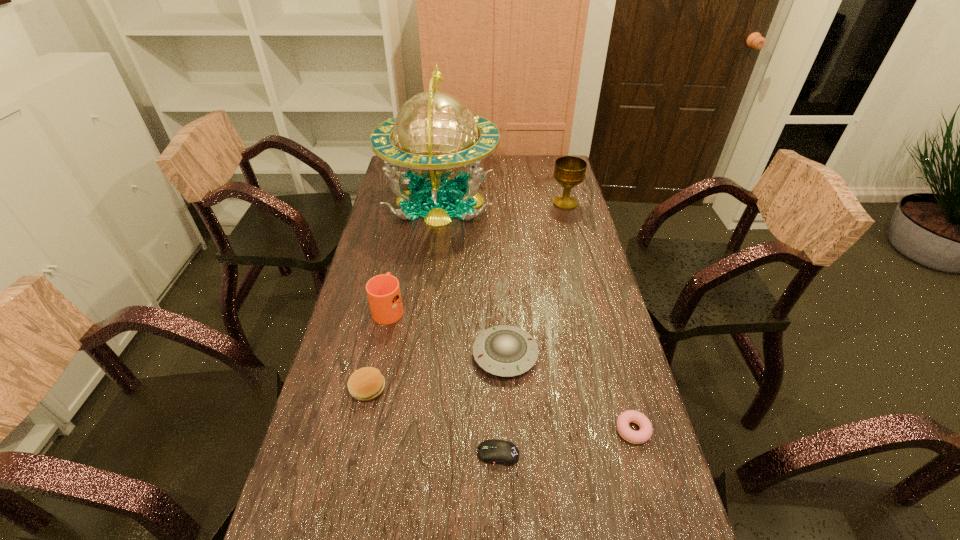
This screenshot has height=540, width=960. Identify the location of free space between the tallest object and the chalice. (503, 202).

Where is `vacant space in between the patty and the doughnut`? vacant space in between the patty and the doughnut is located at coordinates (500, 409).

The height and width of the screenshot is (540, 960). I want to click on free space between the doughnut and the patty, so 500,409.

The height and width of the screenshot is (540, 960). What are the coordinates of `free space that is in between the patty and the saucer` in the screenshot? It's located at (437, 372).

Where is `object identified as the fifth closest to the fifth nearest object`? This screenshot has height=540, width=960. object identified as the fifth closest to the fifth nearest object is located at coordinates (645, 432).

Locate which object ranks fifth in proximity to the saucer. Please provide its 2D coordinates. Your answer should be formatted as a tuple, i.e. [(x, y)], where the tuple contains the x and y coordinates of a point satisfying the conditions above.

[(435, 134)]

Find the location of `free location that satisfies the following two spatial constraints: 1. on the front side of the patty; 2. on the right side of the doughnut`. free location that satisfies the following two spatial constraints: 1. on the front side of the patty; 2. on the right side of the doughnut is located at coordinates (358, 430).

Find the location of a particular element. free location that satisfies the following two spatial constraints: 1. on the front side of the tallest object; 2. on the right side of the computer equipment is located at coordinates (409, 454).

Image resolution: width=960 pixels, height=540 pixels. What are the coordinates of `free space that satisfies the following two spatial constraints: 1. on the back side of the patty; 2. on the left side of the chalice` in the screenshot? It's located at (408, 203).

You are a GUI agent. You are given a task and a screenshot of the screen. Output one action in this format:
    pyautogui.click(x=<x>, y=<y>)
    Task: Click on the vacant area that satisfies the following two spatial constraints: 1. on the back side of the sixth shortest object; 2. on the left side of the saucer
    
    Given the screenshot: What is the action you would take?
    pyautogui.click(x=497, y=203)